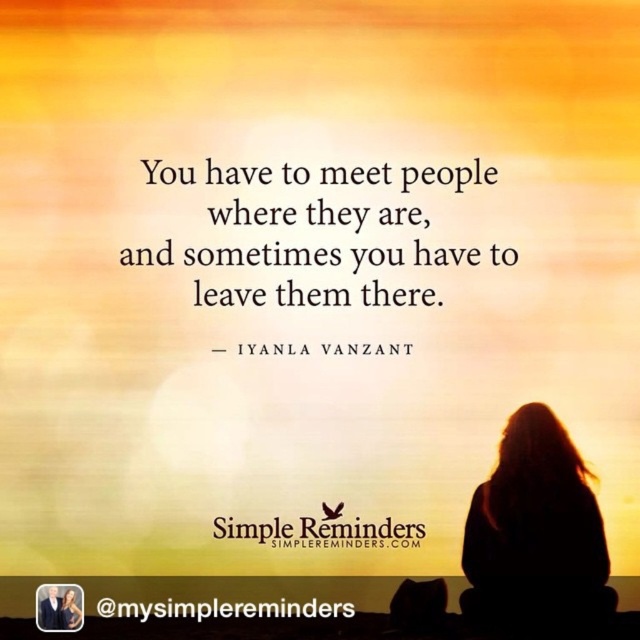
You are designing a poster for a motivational event and need to ensure that the most important element stands out. Given the scene described, which element should you emphasize more, the silhouette hair at right or the black text at center?

The silhouette hair at right is bigger than the black text at center, so you should emphasize the silhouette hair at right more to make it stand out as the most important element.